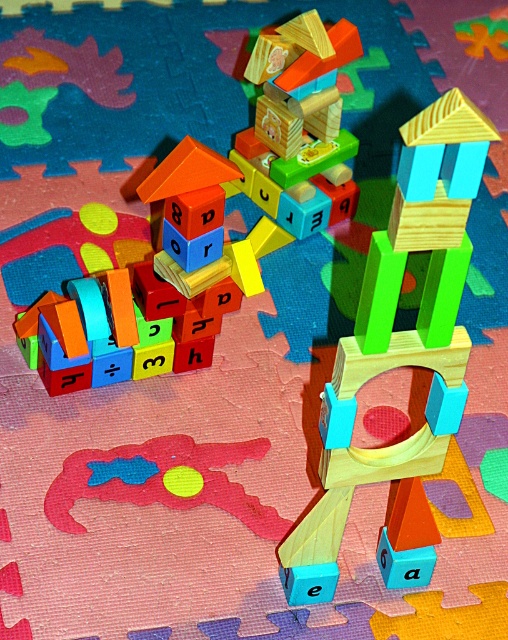
Question: Which is nearer to the wooden toy at center?

Choices:
 (A) rubber duck at center
 (B) wooden tower at center

Answer: (B)

Question: Is wooden tower at center bigger than wooden toy at center?

Choices:
 (A) yes
 (B) no

Answer: (A)

Question: Among these objects, which one is farthest from the camera?

Choices:
 (A) wooden tower at center
 (B) wooden blocks at center
 (C) rubber duck at center

Answer: (C)

Question: Is wooden tower at center bigger than wooden toy at center?

Choices:
 (A) no
 (B) yes

Answer: (B)

Question: Which point is closer to the camera?

Choices:
 (A) wooden toy at center
 (B) wooden tower at center
 (C) wooden blocks at center
 (D) rubber duck at center

Answer: (B)

Question: Can you confirm if wooden toy at center is bigger than rubber duck at center?

Choices:
 (A) yes
 (B) no

Answer: (A)